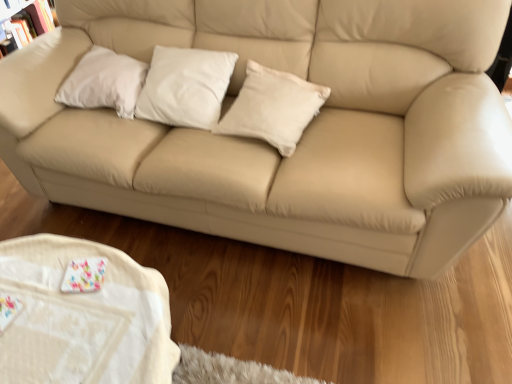
What do you see at coordinates (104, 82) in the screenshot?
I see `white matte pillow at upper left, which ranks as the third pillow in right-to-left order` at bounding box center [104, 82].

This screenshot has width=512, height=384. What are the coordinates of `white cotton pillow at center, which is counted as the first pillow, starting from the right` in the screenshot? It's located at (273, 108).

You are a GUI agent. You are given a task and a screenshot of the screen. Output one action in this format:
    pyautogui.click(x=<x>, y=<y>)
    Task: Click on the white fabric table at lower left
    This screenshot has height=384, width=512.
    Given the screenshot: What is the action you would take?
    pyautogui.click(x=83, y=317)

Where is `matte white bookcase at upper left`? This screenshot has height=384, width=512. matte white bookcase at upper left is located at coordinates (23, 22).

I want to click on beige leather couch at center, so click(x=302, y=136).

Considering the relative sizes of white fabric table at lower left and beige leather couch at center in the image provided, is white fabric table at lower left thinner than beige leather couch at center?

Correct, the width of white fabric table at lower left is less than that of beige leather couch at center.

Does white fabric table at lower left turn towards beige leather couch at center?

No, white fabric table at lower left is not turned towards beige leather couch at center.

Can you confirm if white fabric table at lower left is positioned to the right of beige leather couch at center?

No.

In terms of height, does white fabric table at lower left look taller or shorter compared to white matte pillow at center, which is the 2th pillow in right-to-left order?

Considering their sizes, white fabric table at lower left has more height than white matte pillow at center, which is the 2th pillow in right-to-left order.

In the scene shown: From a real-world perspective, between white fabric table at lower left and white matte pillow at center, the 2th pillow in the left-to-right sequence, who is vertically higher?

white matte pillow at center, the 2th pillow in the left-to-right sequence, is physically above.

Which is more to the left, white fabric table at lower left or white matte pillow at center, the 2th pillow in the left-to-right sequence?

white fabric table at lower left.

Which of these two, white fabric table at lower left or white matte pillow at center, the 2th pillow in the left-to-right sequence, is thinner?

white matte pillow at center, the 2th pillow in the left-to-right sequence, is thinner.

Looking at the image, does beige leather couch at center seem bigger or smaller compared to white matte pillow at upper left, which ranks as the 1th pillow in left-to-right order?

beige leather couch at center is bigger than white matte pillow at upper left, which ranks as the 1th pillow in left-to-right order.

From a real-world perspective, is beige leather couch at center physically located above or below white matte pillow at upper left, which ranks as the third pillow in right-to-left order?

From a real-world perspective, beige leather couch at center is physically below white matte pillow at upper left, which ranks as the third pillow in right-to-left order.

Considering the relative positions of beige leather couch at center and white matte pillow at upper left, which ranks as the 1th pillow in left-to-right order, in the image provided, is beige leather couch at center behind white matte pillow at upper left, which ranks as the 1th pillow in left-to-right order,?

No, it is in front of white matte pillow at upper left, which ranks as the 1th pillow in left-to-right order.

Is beige leather couch at center wider than white matte pillow at upper left, which ranks as the third pillow in right-to-left order?

Indeed, beige leather couch at center has a greater width compared to white matte pillow at upper left, which ranks as the third pillow in right-to-left order.

Could you tell me if white cotton pillow at center, which is counted as the first pillow, starting from the right, is turned towards white matte pillow at upper left, which ranks as the third pillow in right-to-left order?

No, white cotton pillow at center, which is counted as the first pillow, starting from the right, is not facing towards white matte pillow at upper left, which ranks as the third pillow in right-to-left order.

Is white cotton pillow at center, placed as the third pillow when sorted from left to right, shorter than white matte pillow at upper left, which ranks as the 1th pillow in left-to-right order?

Correct, white cotton pillow at center, placed as the third pillow when sorted from left to right, is not as tall as white matte pillow at upper left, which ranks as the 1th pillow in left-to-right order.

Considering the sizes of objects white cotton pillow at center, which is counted as the first pillow, starting from the right, and white matte pillow at upper left, which ranks as the third pillow in right-to-left order, in the image provided, who is smaller, white cotton pillow at center, which is counted as the first pillow, starting from the right, or white matte pillow at upper left, which ranks as the third pillow in right-to-left order,?

white matte pillow at upper left, which ranks as the third pillow in right-to-left order.

Considering the relative sizes of white cotton pillow at center, which is counted as the first pillow, starting from the right, and white fabric table at lower left in the image provided, is white cotton pillow at center, which is counted as the first pillow, starting from the right, wider than white fabric table at lower left?

Incorrect, the width of white cotton pillow at center, which is counted as the first pillow, starting from the right, does not surpass that of white fabric table at lower left.

Considering the sizes of objects white cotton pillow at center, placed as the third pillow when sorted from left to right, and white fabric table at lower left in the image provided, who is shorter, white cotton pillow at center, placed as the third pillow when sorted from left to right, or white fabric table at lower left?

With less height is white cotton pillow at center, placed as the third pillow when sorted from left to right.

Is white cotton pillow at center, which is counted as the first pillow, starting from the right, located outside white fabric table at lower left?

Yes.

From the image's perspective, is white cotton pillow at center, which is counted as the first pillow, starting from the right, over white fabric table at lower left?

Indeed, from the image's perspective, white cotton pillow at center, which is counted as the first pillow, starting from the right, is shown above white fabric table at lower left.

Between point (101, 56) and point (136, 104), which one is positioned behind?

The point (101, 56) is behind.

How many degrees apart are the facing directions of white matte pillow at upper left, which ranks as the third pillow in right-to-left order, and white matte pillow at center, which is the 2th pillow in right-to-left order?

78.5 degrees separate the facing orientations of white matte pillow at upper left, which ranks as the third pillow in right-to-left order, and white matte pillow at center, which is the 2th pillow in right-to-left order.

From the image's perspective, is white matte pillow at upper left, which ranks as the third pillow in right-to-left order, positioned above or below white matte pillow at center, the 2th pillow in the left-to-right sequence?

white matte pillow at upper left, which ranks as the third pillow in right-to-left order, is above white matte pillow at center, the 2th pillow in the left-to-right sequence.

Which of these two, matte white bookcase at upper left or white fabric table at lower left, is bigger?

white fabric table at lower left is bigger.

From the picture: Considering the relative positions of matte white bookcase at upper left and white fabric table at lower left in the image provided, is matte white bookcase at upper left to the left or to the right of white fabric table at lower left?

matte white bookcase at upper left is positioned on white fabric table at lower left's left side.

From the image's perspective, is matte white bookcase at upper left beneath white fabric table at lower left?

Incorrect, from the image's perspective, matte white bookcase at upper left is higher than white fabric table at lower left.

Where is `studio couch above the white fabric table at lower left (from the image's perspective)`? Image resolution: width=512 pixels, height=384 pixels. studio couch above the white fabric table at lower left (from the image's perspective) is located at coordinates coord(302,136).

Image resolution: width=512 pixels, height=384 pixels. What are the coordinates of `pillow that is the 2nd one when counting backward from the white fabric table at lower left` in the screenshot? It's located at (185, 87).

Estimate the real-world distances between objects in this image. Which object is further from matte white bookcase at upper left, white matte pillow at center, the 2th pillow in the left-to-right sequence, or white cotton pillow at center, placed as the third pillow when sorted from left to right?

white cotton pillow at center, placed as the third pillow when sorted from left to right, is positioned further to the anchor matte white bookcase at upper left.

Estimate the real-world distances between objects in this image. Which object is further from white matte pillow at upper left, which ranks as the third pillow in right-to-left order, white fabric table at lower left or matte white bookcase at upper left?

matte white bookcase at upper left is positioned further to the anchor white matte pillow at upper left, which ranks as the third pillow in right-to-left order.

Estimate the real-world distances between objects in this image. Which object is closer to white cotton pillow at center, which is counted as the first pillow, starting from the right, white matte pillow at upper left, which ranks as the 1th pillow in left-to-right order, or white matte pillow at center, which is the 2th pillow in right-to-left order?

white matte pillow at center, which is the 2th pillow in right-to-left order, is positioned closer to the anchor white cotton pillow at center, which is counted as the first pillow, starting from the right.

Looking at the image, which one is located closer to white matte pillow at center, which is the 2th pillow in right-to-left order, beige leather couch at center or white fabric table at lower left?

The object closer to white matte pillow at center, which is the 2th pillow in right-to-left order, is beige leather couch at center.

Based on their spatial positions, is white cotton pillow at center, which is counted as the first pillow, starting from the right, or white matte pillow at upper left, which ranks as the 1th pillow in left-to-right order, closer to matte white bookcase at upper left?

white matte pillow at upper left, which ranks as the 1th pillow in left-to-right order, is closer to matte white bookcase at upper left.

Based on their spatial positions, is beige leather couch at center or white cotton pillow at center, which is counted as the first pillow, starting from the right, further from matte white bookcase at upper left?

white cotton pillow at center, which is counted as the first pillow, starting from the right, is further to matte white bookcase at upper left.

Which object lies further to the anchor point white fabric table at lower left, white matte pillow at upper left, which ranks as the third pillow in right-to-left order, or white matte pillow at center, the 2th pillow in the left-to-right sequence?

The object further to white fabric table at lower left is white matte pillow at upper left, which ranks as the third pillow in right-to-left order.

Which object lies nearer to the anchor point beige leather couch at center, white matte pillow at center, which is the 2th pillow in right-to-left order, or white cotton pillow at center, placed as the third pillow when sorted from left to right?

white cotton pillow at center, placed as the third pillow when sorted from left to right, lies closer to beige leather couch at center than the other object.

You are a GUI agent. You are given a task and a screenshot of the screen. Output one action in this format:
    pyautogui.click(x=<x>, y=<y>)
    Task: Click on the pillow between white matte pillow at center, which is the 2th pillow in right-to-left order, and white fabric table at lower left from top to bottom
    Image resolution: width=512 pixels, height=384 pixels.
    Given the screenshot: What is the action you would take?
    pyautogui.click(x=273, y=108)

You are a GUI agent. You are given a task and a screenshot of the screen. Output one action in this format:
    pyautogui.click(x=<x>, y=<y>)
    Task: Click on the studio couch positioned between white fabric table at lower left and matte white bookcase at upper left from near to far
    The image size is (512, 384).
    Given the screenshot: What is the action you would take?
    pyautogui.click(x=302, y=136)

Identify the location of studio couch between matte white bookcase at upper left and white cotton pillow at center, placed as the third pillow when sorted from left to right, in the horizontal direction. click(302, 136).

The width and height of the screenshot is (512, 384). In order to click on pillow between matte white bookcase at upper left and white matte pillow at center, which is the 2th pillow in right-to-left order, from left to right in this screenshot , I will do `click(104, 82)`.